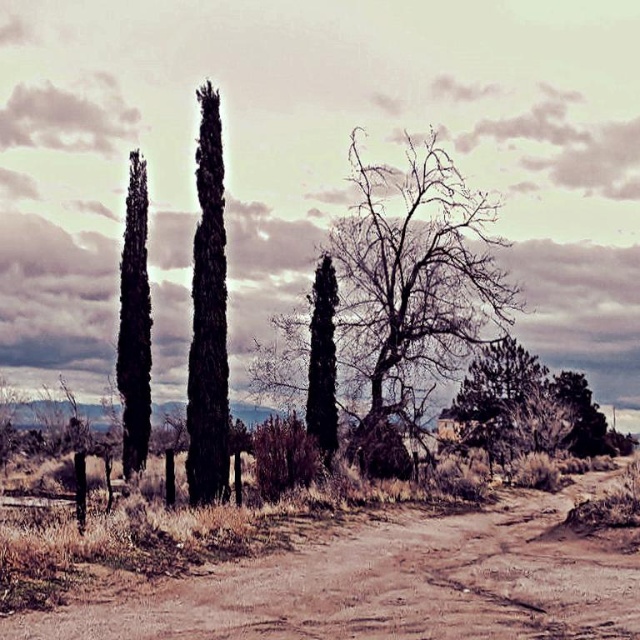
You are a bird looking for a place to perch. You see the bare branches at center and the dark green textured cypress tree at center. Which one is higher up where you can land?

The bare branches at center are above the dark green textured cypress tree at center, so you should land on the bare branches at center.

You are a hiker who needs to cross the brown sandy dirt at center and the bare branches at center. Given that your backpack is 1 meter wide, can you safely pass through the space between them?

The brown sandy dirt at center and the bare branches at center are 8.71 meters apart from each other. Since your backpack is only 1 meter wide, you can safely pass through the space between them as the distance is more than sufficient for your width.